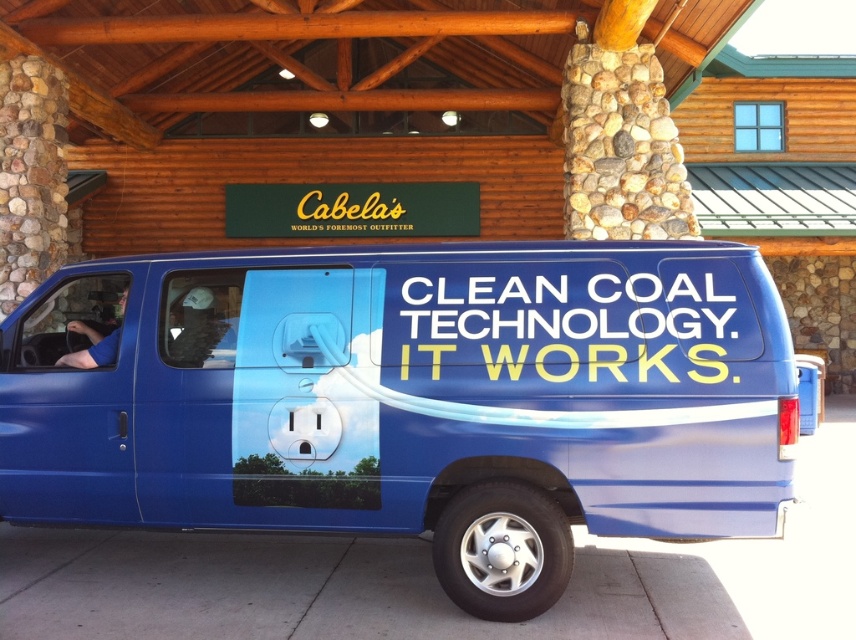
Question: Which point is farther to the camera?

Choices:
 (A) blue fabric shirt at left
 (B) blue metallic van at center

Answer: (A)

Question: Which object is farther from the camera taking this photo?

Choices:
 (A) blue fabric shirt at left
 (B) blue metallic van at center

Answer: (A)

Question: Is blue metallic van at center wider than blue fabric shirt at left?

Choices:
 (A) yes
 (B) no

Answer: (A)

Question: Is blue metallic van at center above blue fabric shirt at left?

Choices:
 (A) yes
 (B) no

Answer: (B)

Question: Does blue metallic van at center appear on the right side of blue fabric shirt at left?

Choices:
 (A) no
 (B) yes

Answer: (B)